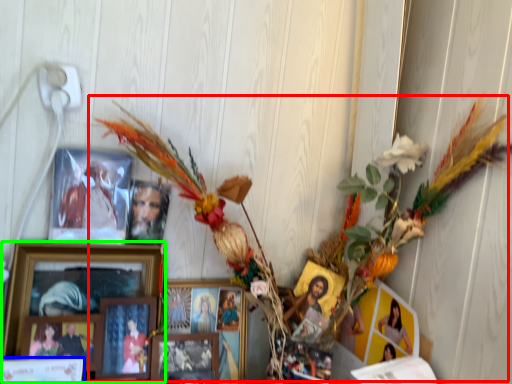
Question: Which is nearer to the floral arrangement (highlighted by a red box)? picture frame (highlighted by a blue box) or picture frame (highlighted by a green box).

Choices:
 (A) picture frame
 (B) picture frame

Answer: (B)